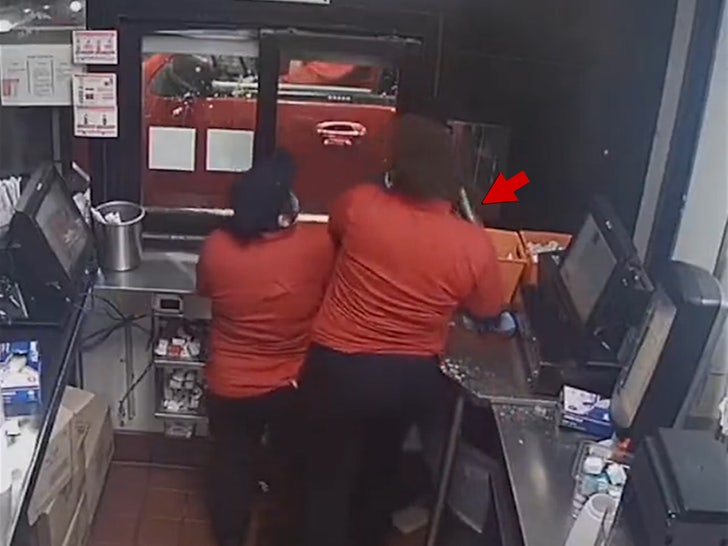
This screenshot has height=546, width=728. I want to click on box, so click(68, 477).